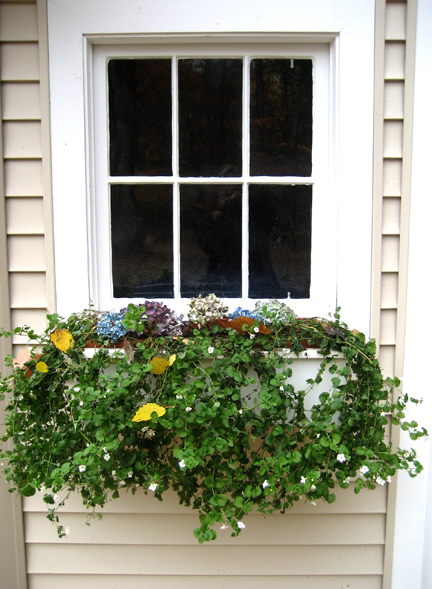
The width and height of the screenshot is (432, 589). What are the coordinates of `white window facing` in the screenshot? It's located at (237, 16).